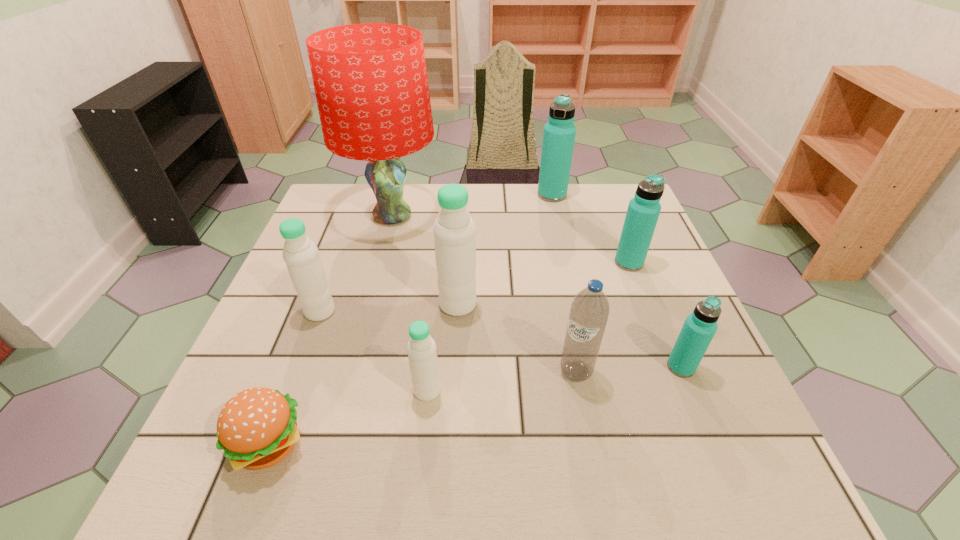
The height and width of the screenshot is (540, 960). In order to click on vacant space that satisfies the following two spatial constraints: 1. on the back side of the smallest blue water bottle; 2. on the left side of the nearest object in this screenshot , I will do click(x=299, y=367).

Find the location of a particular element. free space that satisfies the following two spatial constraints: 1. on the front-facing side of the smallest white water bottle; 2. on the left side of the tallest object is located at coordinates (348, 390).

Find the location of a particular element. This screenshot has height=540, width=960. free space that satisfies the following two spatial constraints: 1. on the front-facing side of the tallest object; 2. on the left side of the second farthest water bottle is located at coordinates (380, 262).